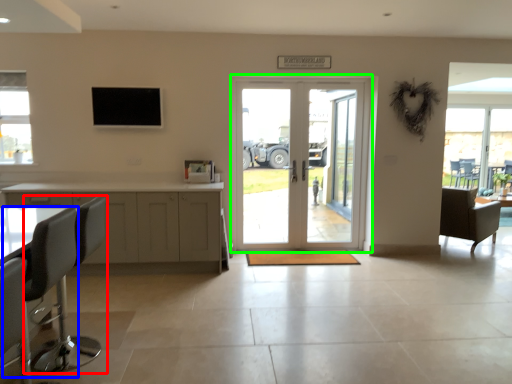
Question: Estimate the real-world distances between objects in this image. Which object is farther from chair (highlighted by a red box), swivel chair (highlighted by a blue box) or door (highlighted by a green box)?

Choices:
 (A) swivel chair
 (B) door

Answer: (B)